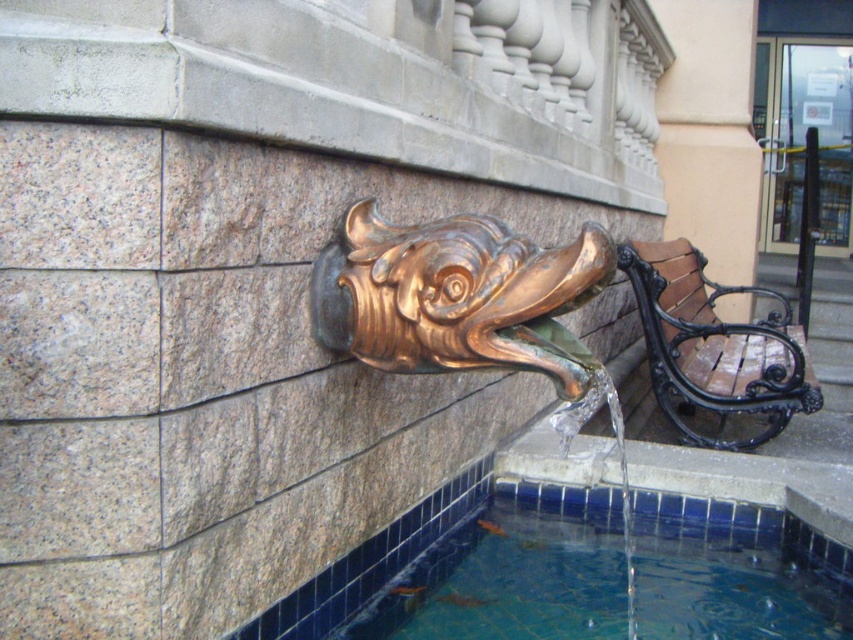
You are standing in front of the fountain and want to locate the gold polished fish head at center. Based on the coordinates provided, where should you look relative to the fountain?

The gold polished fish head at center is located at coordinates approximately 0.503 on the horizontal axis and 0.649 on the vertical axis, meaning it is positioned slightly to the right of the center horizontally and two thirds of the way up vertically from the bottom of the fountain.

You are standing in front of the fountain and want to take a photo of the shiny bronze fish at center. Where should you position yourself to ensure the fish is centered in your camera frame?

To center the shiny bronze fish at center in your camera frame, position yourself directly in front of the fountain at the point corresponding to its 2D location at coordinates approximately 0.464 on the x axis and 0.536 on the y axis.